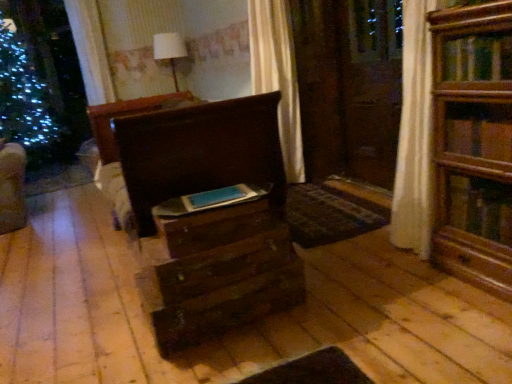
Question: Considering the relative sizes of wooden drawer at center, which is counted as the second drawer, starting from the bottom, and dark wood chest of drawers at center in the image provided, is wooden drawer at center, which is counted as the second drawer, starting from the bottom, taller than dark wood chest of drawers at center?

Choices:
 (A) no
 (B) yes

Answer: (A)

Question: Is wooden drawer at center, which appears as the first drawer when viewed from the top, behind dark wood chest of drawers at center?

Choices:
 (A) no
 (B) yes

Answer: (A)

Question: Is wooden drawer at center, which is counted as the second drawer, starting from the bottom, looking in the opposite direction of dark wood chest of drawers at center?

Choices:
 (A) no
 (B) yes

Answer: (A)

Question: Can you confirm if wooden drawer at center, which appears as the first drawer when viewed from the top, is positioned to the right of dark wood chest of drawers at center?

Choices:
 (A) no
 (B) yes

Answer: (B)

Question: Can you confirm if wooden drawer at center, which appears as the first drawer when viewed from the top, is smaller than dark wood chest of drawers at center?

Choices:
 (A) yes
 (B) no

Answer: (A)

Question: From the image's perspective, is dark wood chest of drawers at center positioned above or below wooden drawer at center, which is counted as the second drawer, starting from the bottom?

Choices:
 (A) above
 (B) below

Answer: (A)

Question: Visually, is dark wood chest of drawers at center positioned to the left or to the right of wooden drawer at center, which appears as the first drawer when viewed from the top?

Choices:
 (A) right
 (B) left

Answer: (B)

Question: Is dark wood chest of drawers at center in front of or behind wooden drawer at center, which appears as the first drawer when viewed from the top, in the image?

Choices:
 (A) behind
 (B) front

Answer: (A)

Question: Is dark wood chest of drawers at center wider or thinner than wooden drawer at center, which is counted as the second drawer, starting from the bottom?

Choices:
 (A) wide
 (B) thin

Answer: (A)

Question: In terms of size, does wooden drawer at center, which is the first drawer from bottom to top, appear bigger or smaller than matte blue book at center?

Choices:
 (A) small
 (B) big

Answer: (B)

Question: Relative to matte blue book at center, is wooden drawer at center, which is the first drawer from bottom to top, in front or behind?

Choices:
 (A) front
 (B) behind

Answer: (A)

Question: Choose the correct answer: Is wooden drawer at center, which is the first drawer from bottom to top, inside matte blue book at center or outside it?

Choices:
 (A) outside
 (B) inside

Answer: (A)

Question: Does point (275, 283) appear closer or farther from the camera than point (184, 208)?

Choices:
 (A) farther
 (B) closer

Answer: (A)

Question: From the image's perspective, is matte blue book at center positioned above or below wooden drawer at center, which is counted as the second drawer, starting from the bottom?

Choices:
 (A) above
 (B) below

Answer: (A)

Question: Does point pyautogui.click(x=245, y=190) appear closer or farther from the camera than point pyautogui.click(x=225, y=215)?

Choices:
 (A) farther
 (B) closer

Answer: (A)